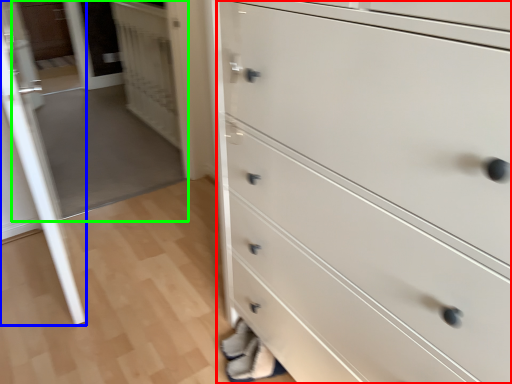
Question: Based on their relative distances, which object is nearer to chest of drawers (highlighted by a red box)? Choose from glass door (highlighted by a blue box) and glass door (highlighted by a green box).

Choices:
 (A) glass door
 (B) glass door

Answer: (A)